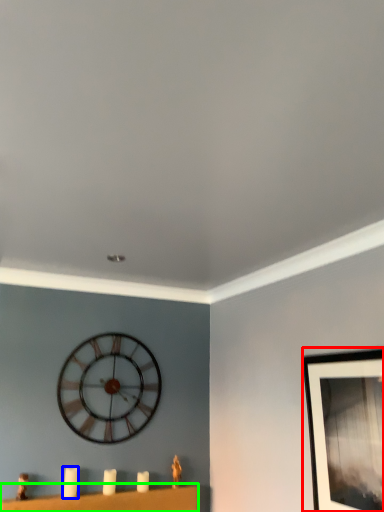
Question: Which is farther away from picture frame (highlighted by a red box)? candle (highlighted by a blue box) or furniture (highlighted by a green box)?

Choices:
 (A) candle
 (B) furniture

Answer: (A)